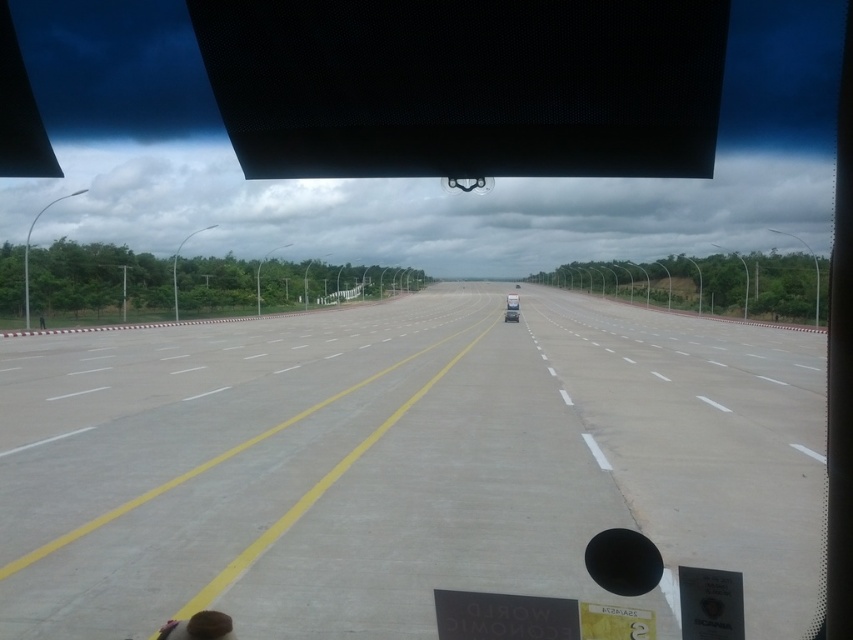
Is concrete at center shorter than white glossy car at center?

Correct, concrete at center is not as tall as white glossy car at center.

Does concrete at center have a greater width compared to white glossy car at center?

Yes.

What do you see at coordinates (403, 465) in the screenshot? I see `concrete at center` at bounding box center [403, 465].

Where is `concrete at center`? concrete at center is located at coordinates (403, 465).